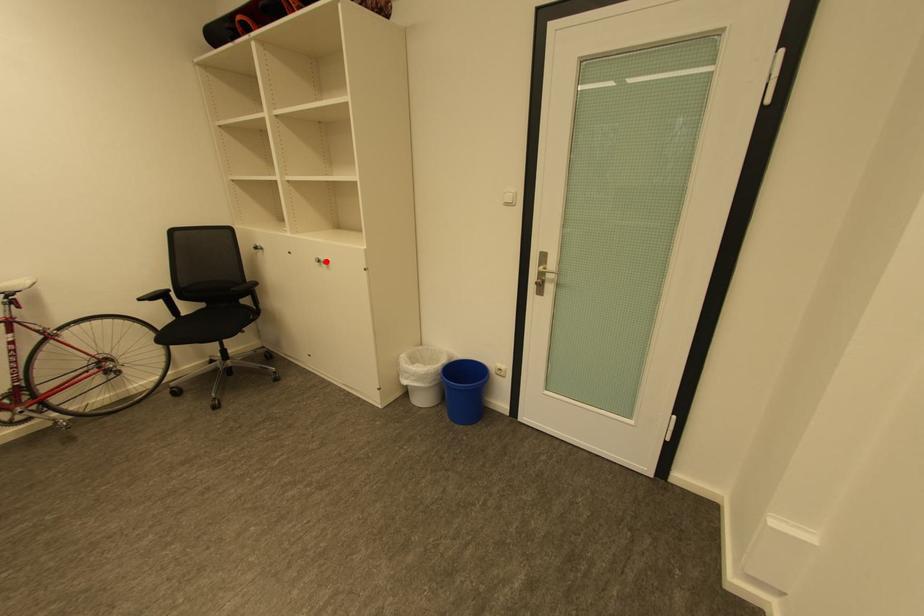
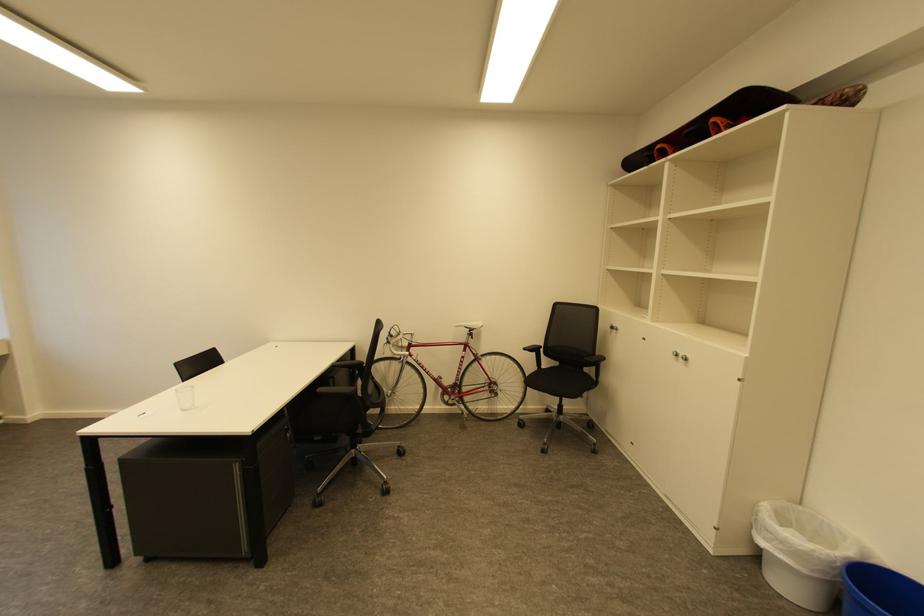
Find the pixel in the second image that matches the highlighted location in the first image.

(684, 355)